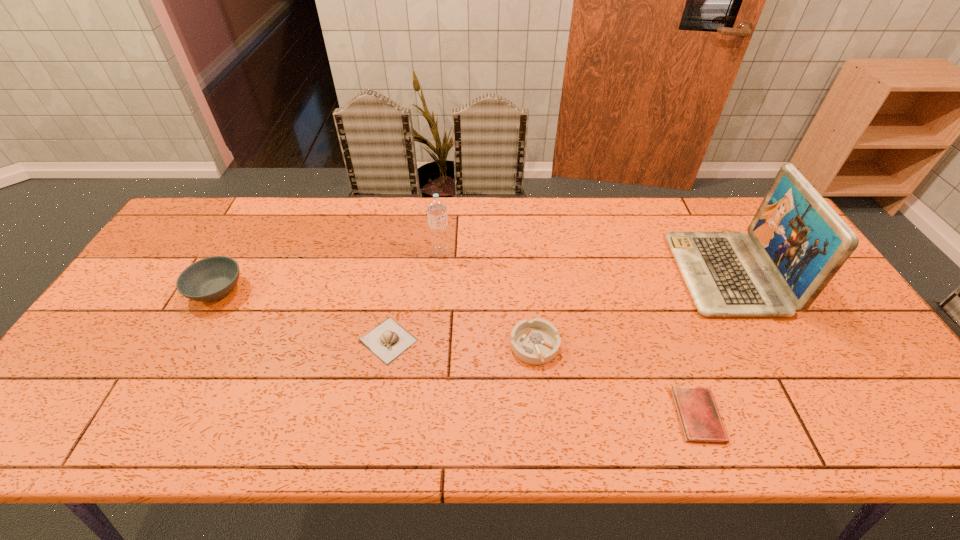
Locate an element on the screen. vacant space that is in between the fourth object from right to left and the laptop computer is located at coordinates (584, 263).

This screenshot has width=960, height=540. Find the location of `vacant point located between the laptop computer and the fourth shortest object`. vacant point located between the laptop computer and the fourth shortest object is located at coordinates (471, 282).

Locate an element on the screen. vacant space that is in between the tallest object and the ashtray is located at coordinates (631, 310).

Identify the location of free space between the third object from right to left and the rightmost object. (631, 310).

You are a GUI agent. You are given a task and a screenshot of the screen. Output one action in this format:
    pyautogui.click(x=<x>, y=<y>)
    Task: Click on the unoccupied area between the water bottle and the soup bowl
    
    Given the screenshot: What is the action you would take?
    pyautogui.click(x=328, y=271)

Locate an element on the screen. vacant space in between the garlic and the third tallest object is located at coordinates (302, 315).

At what (x,y) coordinates should I click in order to perform the action: click on unoccupied area between the tallest object and the shortest object. Please return your answer as a coordinate pair (x, y). Looking at the image, I should click on (712, 345).

This screenshot has width=960, height=540. I want to click on blank region between the second tallest object and the third tallest object, so click(328, 271).

The width and height of the screenshot is (960, 540). Identify the location of object that can be found as the fourth closest to the leftmost object. (699, 417).

Locate which object ranks in proximity to the fourth tallest object. Please provide its 2D coordinates. Your answer should be formatted as a tuple, i.e. [(x, y)], where the tuple contains the x and y coordinates of a point satisfying the conditions above.

[(388, 340)]